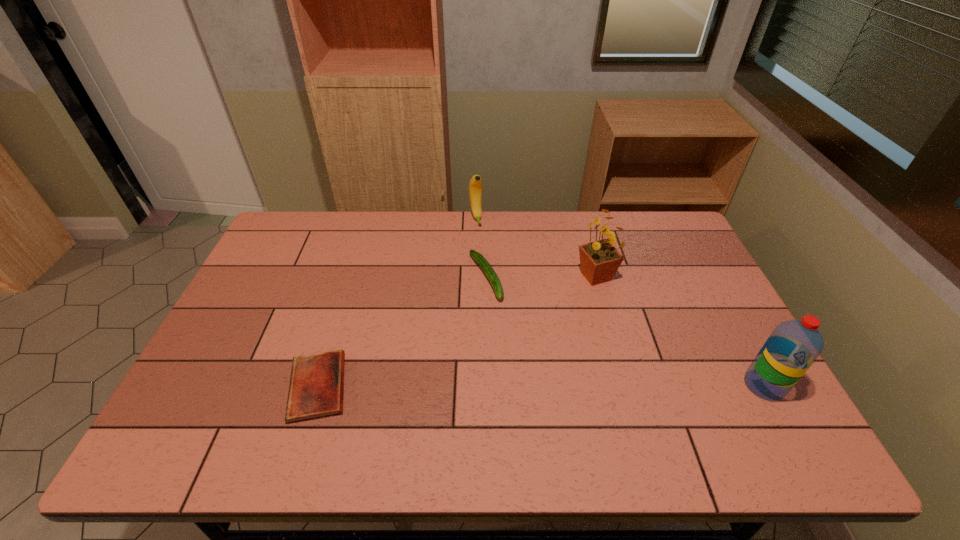
The width and height of the screenshot is (960, 540). What are the coordinates of `free space located at the front of the second object from right to left with flowers visible` in the screenshot? It's located at (559, 369).

At what (x,y) coordinates should I click in order to perform the action: click on vacant space located 0.270m on the front-facing side of the second shortest object. Please return your answer as a coordinate pair (x, y). The width and height of the screenshot is (960, 540). Looking at the image, I should click on (535, 373).

Find the location of a particular element. The height and width of the screenshot is (540, 960). vacant space located on the front-facing side of the second shortest object is located at coordinates (519, 346).

At what (x,y) coordinates should I click in order to perform the action: click on vacant space located on the front-facing side of the second shortest object. Please return your answer as a coordinate pair (x, y). The height and width of the screenshot is (540, 960). Looking at the image, I should click on (542, 385).

The height and width of the screenshot is (540, 960). What are the coordinates of `blank area located from the stem of the third shortest object` in the screenshot? It's located at (504, 307).

In order to click on vacant area situated 0.320m from the stem of the third shortest object in this screenshot , I will do `click(497, 288)`.

The width and height of the screenshot is (960, 540). Identify the location of vacant space located 0.270m from the stem of the third shortest object. tap(494, 277).

This screenshot has height=540, width=960. Find the location of `object that is at the far edge`. object that is at the far edge is located at coordinates (475, 186).

Where is `diary at the near edge`? The image size is (960, 540). diary at the near edge is located at coordinates (316, 387).

At what (x,y) coordinates should I click in order to perform the action: click on water bottle that is at the near edge. Please return your answer as a coordinate pair (x, y). Looking at the image, I should click on (794, 345).